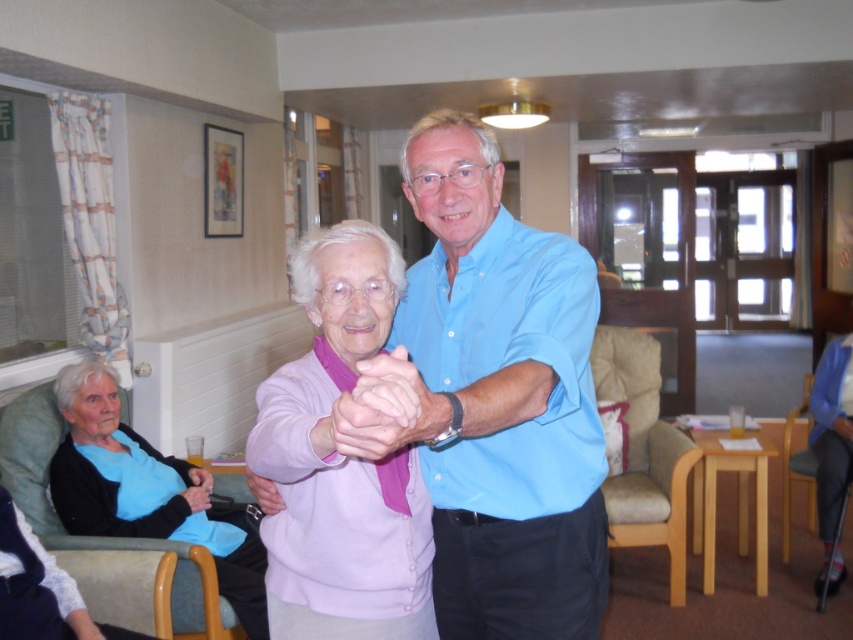
Question: Is smooth pink skin at center bigger than matte pink sweater at center?

Choices:
 (A) yes
 (B) no

Answer: (B)

Question: Which point appears farthest from the camera in this image?

Choices:
 (A) (788, 445)
 (B) (430, 573)

Answer: (A)

Question: Is pink fabric hand at center positioned behind matte blue fabric at lower left?

Choices:
 (A) no
 (B) yes

Answer: (A)

Question: Which object is positioned farthest from the black leather hand at lower left?

Choices:
 (A) smooth pink skin at center
 (B) matte pink sweater at center
 (C) blue cotton shirt at center

Answer: (A)

Question: Which object is farther from the camera taking this photo?

Choices:
 (A) beige fabric armchair at right
 (B) wooden armchair at right
 (C) black leather hand at lower left
 (D) blue cotton shirt at center

Answer: (B)

Question: In this image, where is light blue fabric shirt at lower left located relative to matte blue fabric at lower left?

Choices:
 (A) above
 (B) below

Answer: (B)